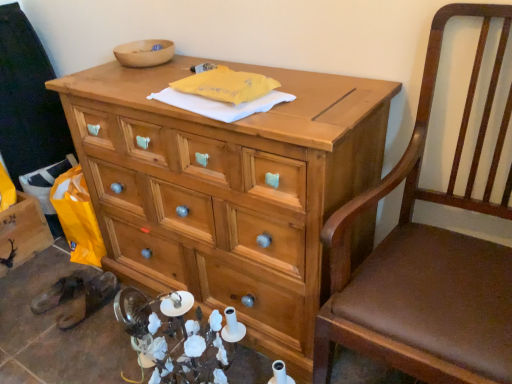
Question: Is natural wood desk at center located outside brown leather chair at right?

Choices:
 (A) no
 (B) yes

Answer: (B)

Question: Considering the relative sizes of natural wood desk at center and brown leather chair at right in the image provided, is natural wood desk at center shorter than brown leather chair at right?

Choices:
 (A) no
 (B) yes

Answer: (B)

Question: Does natural wood desk at center appear on the left side of brown leather chair at right?

Choices:
 (A) yes
 (B) no

Answer: (A)

Question: Is the position of natural wood desk at center more distant than that of brown leather chair at right?

Choices:
 (A) yes
 (B) no

Answer: (A)

Question: Can you confirm if natural wood desk at center is bigger than brown leather chair at right?

Choices:
 (A) yes
 (B) no

Answer: (A)

Question: Is brown leather sandals at lower left wider or thinner than wooden bowl at upper center?

Choices:
 (A) thin
 (B) wide

Answer: (B)

Question: Is point 84,291 positioned closer to the camera than point 116,49?

Choices:
 (A) farther
 (B) closer

Answer: (A)

Question: From the image's perspective, is brown leather sandals at lower left above or below wooden bowl at upper center?

Choices:
 (A) above
 (B) below

Answer: (B)

Question: Is brown leather sandals at lower left in front of or behind wooden bowl at upper center in the image?

Choices:
 (A) behind
 (B) front

Answer: (A)

Question: Is wooden crate at lower left inside the boundaries of natural wood desk at center, or outside?

Choices:
 (A) outside
 (B) inside

Answer: (A)

Question: From the image's perspective, is wooden crate at lower left located above or below natural wood desk at center?

Choices:
 (A) above
 (B) below

Answer: (B)

Question: Considering the positions of point (26, 256) and point (266, 279), is point (26, 256) closer or farther from the camera than point (266, 279)?

Choices:
 (A) farther
 (B) closer

Answer: (A)

Question: From a real-world perspective, relative to natural wood desk at center, is wooden crate at lower left vertically above or below?

Choices:
 (A) above
 (B) below

Answer: (B)

Question: From their relative heights in the image, would you say wooden bowl at upper center is taller or shorter than natural wood desk at center?

Choices:
 (A) tall
 (B) short

Answer: (B)

Question: In the image, is wooden bowl at upper center positioned in front of or behind natural wood desk at center?

Choices:
 (A) behind
 (B) front

Answer: (A)